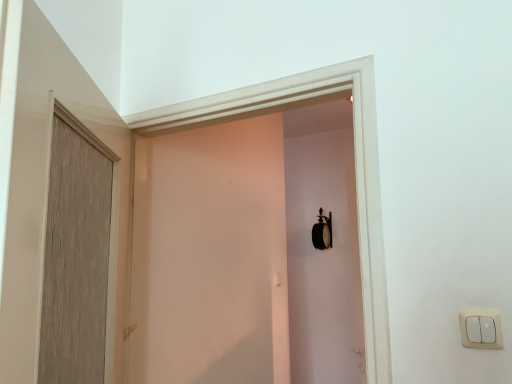
Question: From the image's perspective, is wooden door at left located above or below matte white screen door at center?

Choices:
 (A) below
 (B) above

Answer: (B)

Question: In terms of height, does wooden door at left look taller or shorter compared to matte white screen door at center?

Choices:
 (A) short
 (B) tall

Answer: (A)

Question: Which is farther from the matte white screen door at center?

Choices:
 (A) wooden door at left
 (B) white plastic light switch at lower right

Answer: (B)

Question: Which is nearer to the white plastic light switch at lower right?

Choices:
 (A) matte white screen door at center
 (B) wooden door at left

Answer: (B)